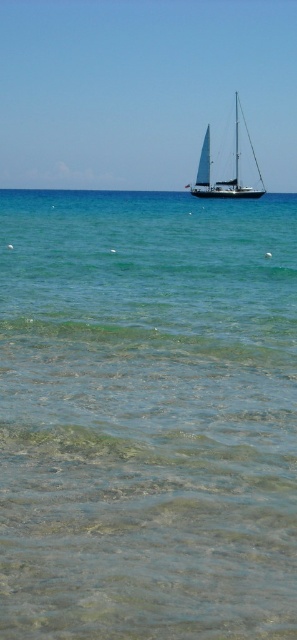
Is point (13, 627) positioned behind point (237, 122)?

No, (13, 627) is in front of (237, 122).

Is point (133, 467) less distant than point (196, 179)?

Yes, point (133, 467) is in front of point (196, 179).

The image size is (297, 640). What do you see at coordinates (147, 417) in the screenshot?
I see `clear water at center` at bounding box center [147, 417].

Locate an element on the screen. The image size is (297, 640). clear water at center is located at coordinates (147, 417).